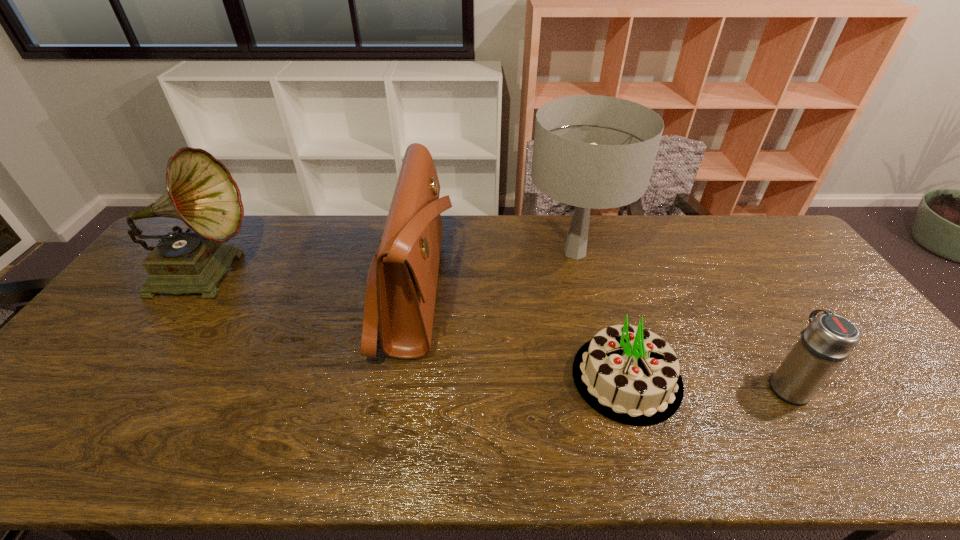
In order to click on vacant point that satisfies the following two spatial constraints: 1. on the front flap of the fourth object from right to left; 2. with a handle on the side of the rightmost object in this screenshot , I will do `click(397, 386)`.

You are a GUI agent. You are given a task and a screenshot of the screen. Output one action in this format:
    pyautogui.click(x=<x>, y=<y>)
    Task: Click on the free region that satisfies the following two spatial constraints: 1. on the front flap of the second object from left to right; 2. on the left side of the shortest object
    This screenshot has width=960, height=540.
    Given the screenshot: What is the action you would take?
    pyautogui.click(x=398, y=377)